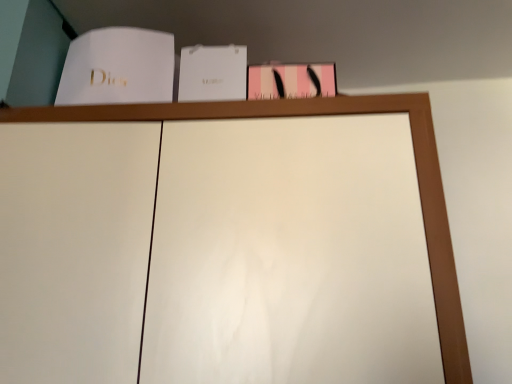
The width and height of the screenshot is (512, 384). Describe the element at coordinates (212, 73) in the screenshot. I see `white paper at center, the 1th paperback book from the right` at that location.

Image resolution: width=512 pixels, height=384 pixels. In order to click on white paper at center, the 1th paperback book from the right in this screenshot , I will do [212, 73].

This screenshot has width=512, height=384. Describe the element at coordinates (118, 68) in the screenshot. I see `white paper at upper left, placed as the first paperback book when sorted from left to right` at that location.

In order to click on white paper at upper left, placed as the first paperback book when sorted from left to right in this screenshot , I will do pyautogui.click(x=118, y=68).

At what (x,y) coordinates should I click in order to perform the action: click on white paper at center, the 1th paperback book from the right. Please return your answer as a coordinate pair (x, y). Image resolution: width=512 pixels, height=384 pixels. Looking at the image, I should click on (212, 73).

Which object is positioned more to the right, white paper at center, the second paperback book in the left-to-right sequence, or white paper at upper left, placed as the first paperback book when sorted from left to right?

Positioned to the right is white paper at center, the second paperback book in the left-to-right sequence.

Between white paper at center, the second paperback book in the left-to-right sequence, and white paper at upper left, placed as the first paperback book when sorted from left to right, which one is positioned behind?

white paper at center, the second paperback book in the left-to-right sequence, is further from the camera.

Is point (216, 61) farther from viewer compared to point (113, 36)?

Yes.

From the image's perspective, is white paper at center, the 1th paperback book from the right, located beneath white paper at upper left, which is the 2th paperback book in right-to-left order?

Yes, from the image's perspective, white paper at center, the 1th paperback book from the right, is beneath white paper at upper left, which is the 2th paperback book in right-to-left order.

Based on the photo, from a real-world perspective, is white paper at center, the 1th paperback book from the right, above or below white paper at upper left, which is the 2th paperback book in right-to-left order?

Clearly, from a real-world perspective, white paper at center, the 1th paperback book from the right, is below white paper at upper left, which is the 2th paperback book in right-to-left order.

Does white paper at center, the second paperback book in the left-to-right sequence, have a greater width compared to white paper at upper left, which is the 2th paperback book in right-to-left order?

No.

Can you confirm if white paper at center, the second paperback book in the left-to-right sequence, is taller than white paper at upper left, placed as the first paperback book when sorted from left to right?

In fact, white paper at center, the second paperback book in the left-to-right sequence, may be shorter than white paper at upper left, placed as the first paperback book when sorted from left to right.

Can you confirm if white paper at center, the second paperback book in the left-to-right sequence, is smaller than white paper at upper left, placed as the first paperback book when sorted from left to right?

Indeed, white paper at center, the second paperback book in the left-to-right sequence, has a smaller size compared to white paper at upper left, placed as the first paperback book when sorted from left to right.

Do you think white paper at center, the second paperback book in the left-to-right sequence, is within white paper at upper left, which is the 2th paperback book in right-to-left order, or outside of it?

white paper at center, the second paperback book in the left-to-right sequence, is outside white paper at upper left, which is the 2th paperback book in right-to-left order.

Is white paper at center, the 1th paperback book from the right, positioned far away from white paper at upper left, placed as the first paperback book when sorted from left to right?

No, white paper at center, the 1th paperback book from the right, is not far away from white paper at upper left, placed as the first paperback book when sorted from left to right.

Is white paper at center, the second paperback book in the left-to-right sequence, aimed at white paper at upper left, placed as the first paperback book when sorted from left to right?

No, white paper at center, the second paperback book in the left-to-right sequence, is not facing towards white paper at upper left, placed as the first paperback book when sorted from left to right.

How different are the orientations of white paper at center, the second paperback book in the left-to-right sequence, and white paper at upper left, placed as the first paperback book when sorted from left to right, in degrees?

The angle between the facing direction of white paper at center, the second paperback book in the left-to-right sequence, and the facing direction of white paper at upper left, placed as the first paperback book when sorted from left to right, is 0.00411 degrees.

Measure the distance from white paper at center, the second paperback book in the left-to-right sequence, to white paper at upper left, placed as the first paperback book when sorted from left to right.

white paper at center, the second paperback book in the left-to-right sequence, and white paper at upper left, placed as the first paperback book when sorted from left to right, are 11.96 centimeters apart.

The image size is (512, 384). Identify the location of paperback book below the white paper at upper left, placed as the first paperback book when sorted from left to right (from a real-world perspective). (212, 73).

Considering the relative positions of white paper at upper left, which is the 2th paperback book in right-to-left order, and white paper at center, the 1th paperback book from the right, in the image provided, is white paper at upper left, which is the 2th paperback book in right-to-left order, to the left of white paper at center, the 1th paperback book from the right, from the viewer's perspective?

Correct, you'll find white paper at upper left, which is the 2th paperback book in right-to-left order, to the left of white paper at center, the 1th paperback book from the right.

Is white paper at upper left, which is the 2th paperback book in right-to-left order, in front of or behind white paper at center, the 1th paperback book from the right, in the image?

white paper at upper left, which is the 2th paperback book in right-to-left order, is in front of white paper at center, the 1th paperback book from the right.

Between point (74, 62) and point (190, 57), which one is positioned behind?

Positioned behind is point (190, 57).

From the image's perspective, is white paper at upper left, which is the 2th paperback book in right-to-left order, on white paper at center, the 1th paperback book from the right?

Indeed, from the image's perspective, white paper at upper left, which is the 2th paperback book in right-to-left order, is shown above white paper at center, the 1th paperback book from the right.

From a real-world perspective, which is physically below, white paper at upper left, placed as the first paperback book when sorted from left to right, or white paper at center, the 1th paperback book from the right?

In real-world perspective, white paper at center, the 1th paperback book from the right, is lower.

Is white paper at upper left, placed as the first paperback book when sorted from left to right, wider than white paper at center, the 1th paperback book from the right?

Indeed, white paper at upper left, placed as the first paperback book when sorted from left to right, has a greater width compared to white paper at center, the 1th paperback book from the right.

Considering the sizes of objects white paper at upper left, placed as the first paperback book when sorted from left to right, and white paper at center, the 1th paperback book from the right, in the image provided, who is shorter, white paper at upper left, placed as the first paperback book when sorted from left to right, or white paper at center, the 1th paperback book from the right,?

white paper at center, the 1th paperback book from the right.

In the scene shown: Which of these two, white paper at upper left, which is the 2th paperback book in right-to-left order, or white paper at center, the 1th paperback book from the right, is smaller?

Smaller between the two is white paper at center, the 1th paperback book from the right.

Is white paper at upper left, which is the 2th paperback book in right-to-left order, positioned beyond the bounds of white paper at center, the 1th paperback book from the right?

Yes, white paper at upper left, which is the 2th paperback book in right-to-left order, is not within white paper at center, the 1th paperback book from the right.

Can you see white paper at upper left, placed as the first paperback book when sorted from left to right, touching white paper at center, the second paperback book in the left-to-right sequence?

There is a gap between white paper at upper left, placed as the first paperback book when sorted from left to right, and white paper at center, the second paperback book in the left-to-right sequence.

Looking at this image, could you tell me if white paper at upper left, which is the 2th paperback book in right-to-left order, is facing white paper at center, the second paperback book in the left-to-right sequence?

No, white paper at upper left, which is the 2th paperback book in right-to-left order, is not facing towards white paper at center, the second paperback book in the left-to-right sequence.

Where is `paperback book on the right of white paper at upper left, placed as the first paperback book when sorted from left to right`? paperback book on the right of white paper at upper left, placed as the first paperback book when sorted from left to right is located at coordinates (212, 73).

Identify the location of paperback book in front of the white paper at center, the 1th paperback book from the right. This screenshot has width=512, height=384. (118, 68).

The width and height of the screenshot is (512, 384). In order to click on paperback book on the left of white paper at center, the 1th paperback book from the right in this screenshot , I will do `click(118, 68)`.